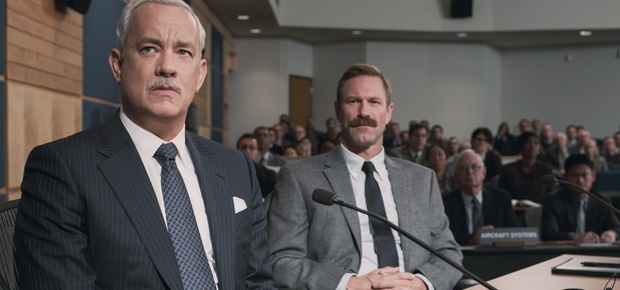
Find the location of a particular element. This screenshot has height=290, width=620. wall is located at coordinates (558, 93), (446, 97), (87, 52).